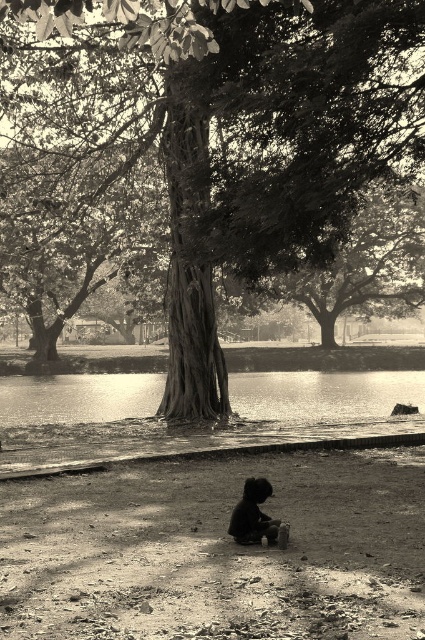
You are standing in the outdoor scene and want to take a photo of the dark skin child at center without the sepia textured tree at center appearing in the background. Is this possible given their positions?

The sepia textured tree at center is positioned on the left side of the dark skin child at center, so you can move to the right side of the child to take the photo without the tree in the background.

You are standing in the scene and want to reach the glistening water at center. Based on the coordinates provided, in which direction should you move from your current position at the tree?

The glistening water at center is located at coordinates point (323, 396), so you should move towards the center of the image from the tree to reach it.